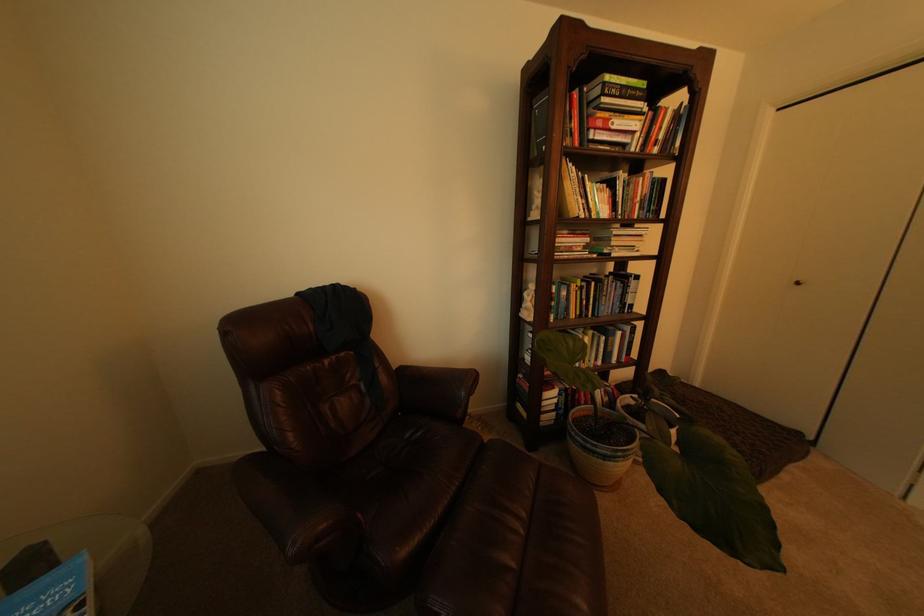
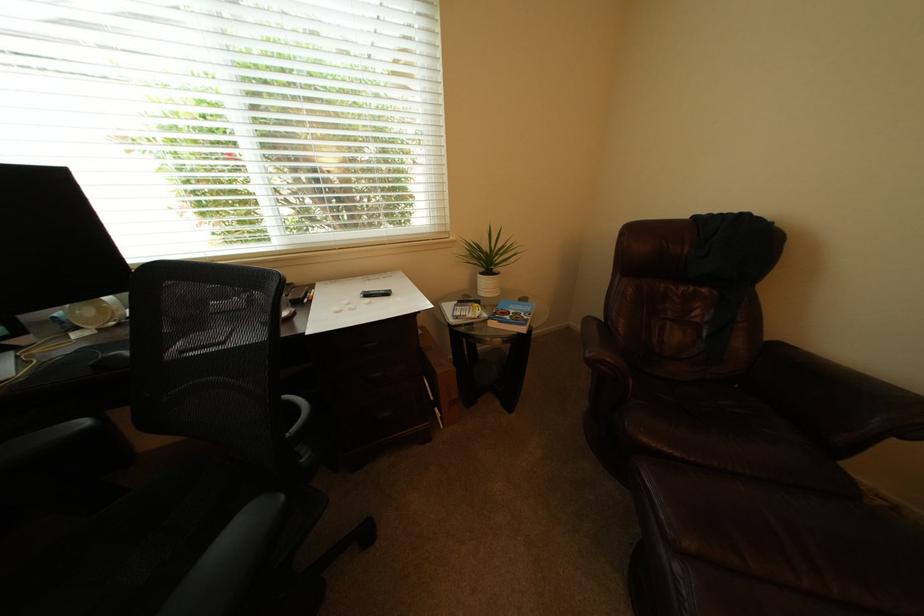
Find the pixel in the second image that matches point 210,474 in the first image.

(579, 331)